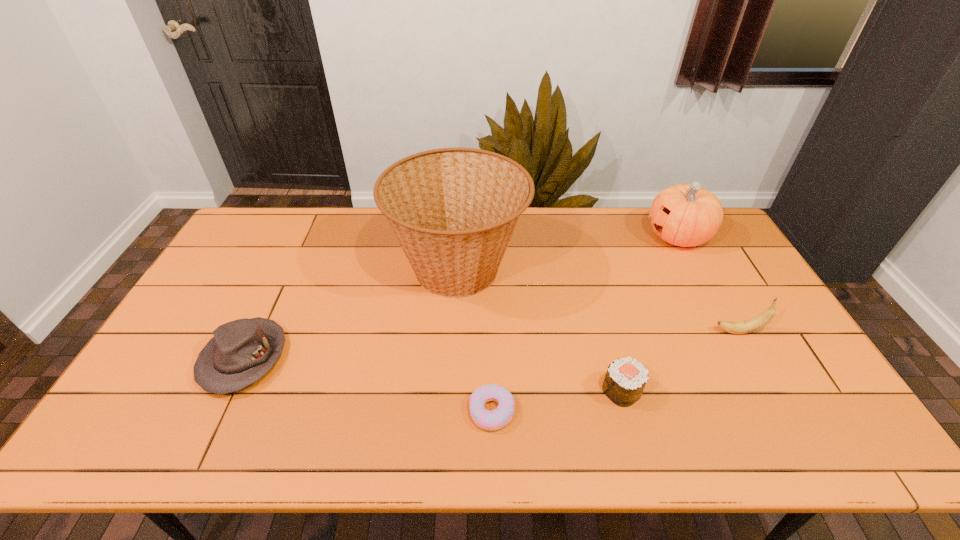
Where is `pumpkin that is at the right edge`? pumpkin that is at the right edge is located at coordinates (684, 215).

At what (x,y) coordinates should I click in order to perform the action: click on banana situated at the right edge. Please return your answer as a coordinate pair (x, y). Looking at the image, I should click on (764, 318).

What are the coordinates of `object at the far right corner` in the screenshot? It's located at (684, 215).

The width and height of the screenshot is (960, 540). In the image, there is a desktop. In order to click on free space at the far edge in this screenshot , I will do `click(578, 220)`.

Where is `vacant space at the near edge`? This screenshot has height=540, width=960. vacant space at the near edge is located at coordinates (310, 435).

Find the location of a particular element. This screenshot has width=960, height=540. vacant space at the left edge of the desktop is located at coordinates (198, 314).

At what (x,y) coordinates should I click in order to perform the action: click on vacant position at the right edge of the desktop. Please return your answer as a coordinate pair (x, y). This screenshot has height=540, width=960. Looking at the image, I should click on (804, 370).

You are a GUI agent. You are given a task and a screenshot of the screen. Output one action in this format:
    pyautogui.click(x=<x>, y=<y>)
    Task: Click on the vacant area at the far left corner of the desktop
    
    Given the screenshot: What is the action you would take?
    pyautogui.click(x=248, y=221)

In order to click on vacant position at the near left corner of the desktop in this screenshot , I will do `click(166, 427)`.

Image resolution: width=960 pixels, height=540 pixels. In order to click on free space that is in between the third tallest object and the fifth shortest object in this screenshot , I will do `click(708, 284)`.